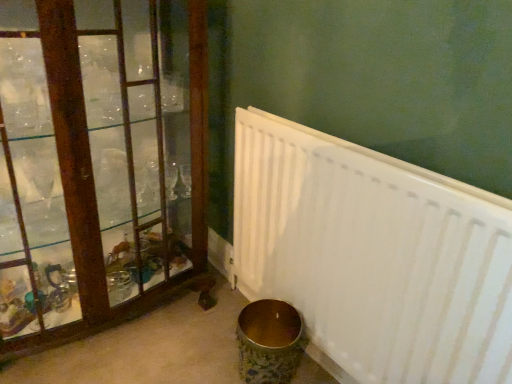
The width and height of the screenshot is (512, 384). Identify the location of wooden frame at left. (99, 163).

What do you see at coordinates (99, 163) in the screenshot? The image size is (512, 384). I see `wooden frame at left` at bounding box center [99, 163].

Locate an element on the screen. This screenshot has height=384, width=512. white matte radiator at lower right is located at coordinates (373, 256).

The width and height of the screenshot is (512, 384). Describe the element at coordinates (373, 256) in the screenshot. I see `white matte radiator at lower right` at that location.

You are a GUI agent. You are given a task and a screenshot of the screen. Output one action in this format:
    pyautogui.click(x=<x>, y=<y>)
    Task: Click on the wooden frame at left
    
    Given the screenshot: What is the action you would take?
    (99, 163)

Considering the relative positions of white matte radiator at lower right and wooden frame at left in the image provided, is white matte radiator at lower right to the right of wooden frame at left from the viewer's perspective?

Yes, white matte radiator at lower right is to the right of wooden frame at left.

From the picture: Which object is further away from the camera, white matte radiator at lower right or wooden frame at left?

wooden frame at left is more distant.

Considering the positions of points (247, 168) and (150, 222), is point (247, 168) closer to camera compared to point (150, 222)?

Yes, it is in front of point (150, 222).

From the image's perspective, would you say white matte radiator at lower right is positioned over wooden frame at left?

No.

From a real-world perspective, who is located lower, white matte radiator at lower right or wooden frame at left?

white matte radiator at lower right.

Which object is thinner, white matte radiator at lower right or wooden frame at left?

white matte radiator at lower right.

Considering the sizes of objects white matte radiator at lower right and wooden frame at left in the image provided, who is shorter, white matte radiator at lower right or wooden frame at left?

white matte radiator at lower right is shorter.

Does white matte radiator at lower right have a larger size compared to wooden frame at left?

No, white matte radiator at lower right is not bigger than wooden frame at left.

Is white matte radiator at lower right not inside wooden frame at left?

Yes, white matte radiator at lower right is not within wooden frame at left.

Is there a large distance between white matte radiator at lower right and wooden frame at left?

No, white matte radiator at lower right is in close proximity to wooden frame at left.

Is wooden frame at left at the back of white matte radiator at lower right?

white matte radiator at lower right is not turned away from wooden frame at left.

How many degrees apart are the facing directions of white matte radiator at lower right and wooden frame at left?

→ 90.5 degrees separate the facing orientations of white matte radiator at lower right and wooden frame at left.

The image size is (512, 384). In order to click on window behind the white matte radiator at lower right in this screenshot , I will do `click(99, 163)`.

In the image, is wooden frame at left on the left side or the right side of white matte radiator at lower right?

Clearly, wooden frame at left is on the left of white matte radiator at lower right in the image.

Relative to white matte radiator at lower right, is wooden frame at left in front or behind?

wooden frame at left is behind white matte radiator at lower right.

Is point (161, 94) positioned before point (472, 270)?

No, it is not.

From the image's perspective, is wooden frame at left beneath white matte radiator at lower right?

Actually, wooden frame at left appears above white matte radiator at lower right in the image.

From a real-world perspective, relative to white matte radiator at lower right, is wooden frame at left vertically above or below?

wooden frame at left is above white matte radiator at lower right.

Can you confirm if wooden frame at left is thinner than white matte radiator at lower right?

No, wooden frame at left is not thinner than white matte radiator at lower right.

Considering the sizes of wooden frame at left and white matte radiator at lower right in the image, is wooden frame at left taller or shorter than white matte radiator at lower right?

Clearly, wooden frame at left is taller compared to white matte radiator at lower right.

Is wooden frame at left bigger than white matte radiator at lower right?

Correct, wooden frame at left is larger in size than white matte radiator at lower right.

Is wooden frame at left located outside white matte radiator at lower right?

Absolutely, wooden frame at left is external to white matte radiator at lower right.

Is wooden frame at left positioned far away from white matte radiator at lower right?

No, wooden frame at left is in close proximity to white matte radiator at lower right.

Could you tell me if wooden frame at left is facing white matte radiator at lower right?

No, wooden frame at left is not turned towards white matte radiator at lower right.

Measure the distance from wooden frame at left to white matte radiator at lower right.

They are 53.69 centimeters apart.

This screenshot has width=512, height=384. In order to click on radiator below the wooden frame at left (from the image's perspective) in this screenshot , I will do `click(373, 256)`.

At what (x,y) coordinates should I click in order to perform the action: click on radiator in front of the wooden frame at left. Please return your answer as a coordinate pair (x, y). Looking at the image, I should click on (373, 256).

Where is `window located above the white matte radiator at lower right (from a real-world perspective)`? window located above the white matte radiator at lower right (from a real-world perspective) is located at coordinates (99, 163).